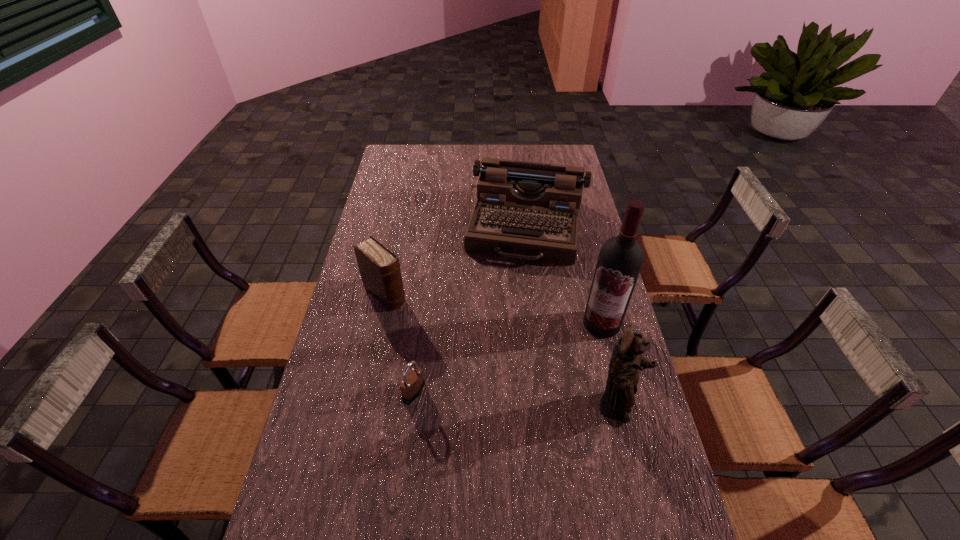
This screenshot has height=540, width=960. I want to click on vacant space that is in between the tallest object and the diary, so click(x=493, y=309).

This screenshot has width=960, height=540. I want to click on unoccupied area between the fourth shortest object and the second object from left to right, so click(516, 400).

This screenshot has width=960, height=540. I want to click on free point between the typewriter and the shortest object, so click(470, 309).

At what (x,y) coordinates should I click in order to perform the action: click on free spot between the figurine and the typewriter. Please return your answer as a coordinate pair (x, y). Looking at the image, I should click on (572, 318).

In order to click on unoccupied area between the figurine and the shortest object in this screenshot , I will do `click(516, 400)`.

Locate an element on the screen. Image resolution: width=960 pixels, height=540 pixels. free space between the typewriter and the leftmost object is located at coordinates (456, 260).

I want to click on free spot between the second shortest object and the fourth shortest object, so [501, 352].

Choose which object is the nearest neighbor to the wine bottle. Please provide its 2D coordinates. Your answer should be formatted as a tuple, i.e. [(x, y)], where the tuple contains the x and y coordinates of a point satisfying the conditions above.

[(623, 374)]

Identify the location of the third closest object to the diary. [620, 260].

Find the location of a particular element. The image size is (960, 540). vacant area in the image that satisfies the following two spatial constraints: 1. on the front side of the farthest object; 2. on the left side of the wine bottle is located at coordinates (539, 323).